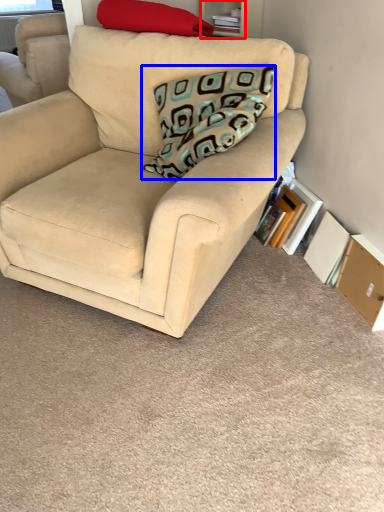
Question: Among these objects, which one is farthest to the camera, shelf (highlighted by a red box) or pillow (highlighted by a blue box)?

Choices:
 (A) shelf
 (B) pillow

Answer: (A)